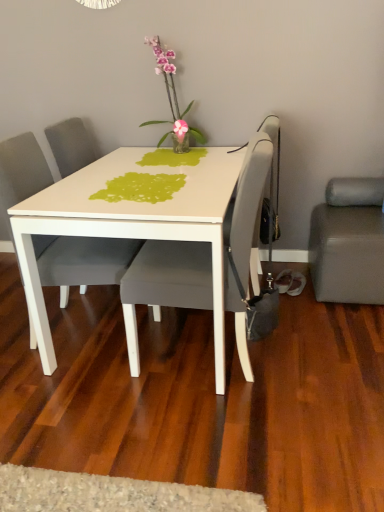
This screenshot has width=384, height=512. In order to click on spots to the right of matte gray chair at center, which is counted as the first chair, starting from the right in this screenshot , I will do pyautogui.click(x=316, y=355).